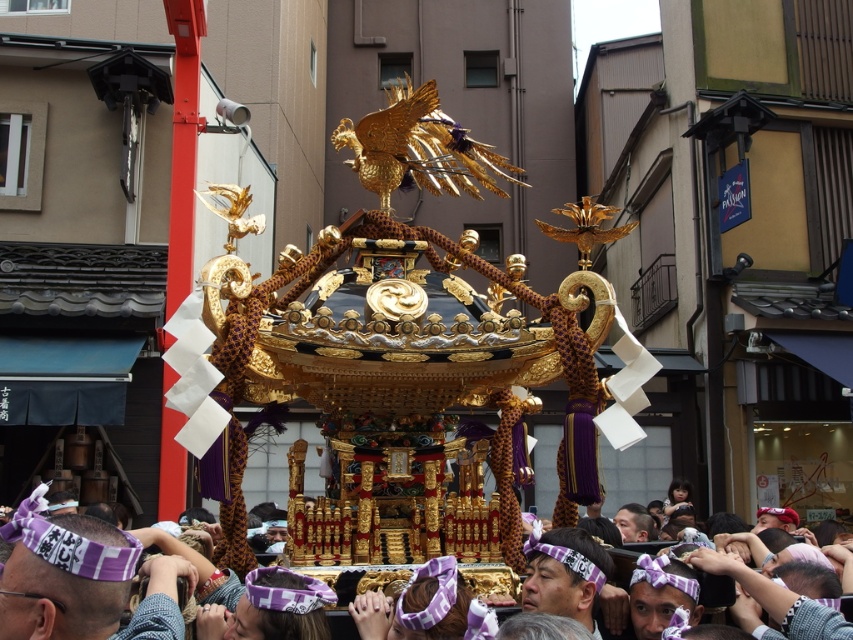
Is point (27, 595) more distant than point (558, 580)?

No, (27, 595) is closer to viewer.

Is gold ornate float at center thinner than purple fabric headband at center?

No, gold ornate float at center is not thinner than purple fabric headband at center.

Which is behind, point (167, 586) or point (582, 620)?

Positioned behind is point (582, 620).

Find the location of a particular element. Image resolution: width=853 pixels, height=640 pixels. gold ornate float at center is located at coordinates (62, 573).